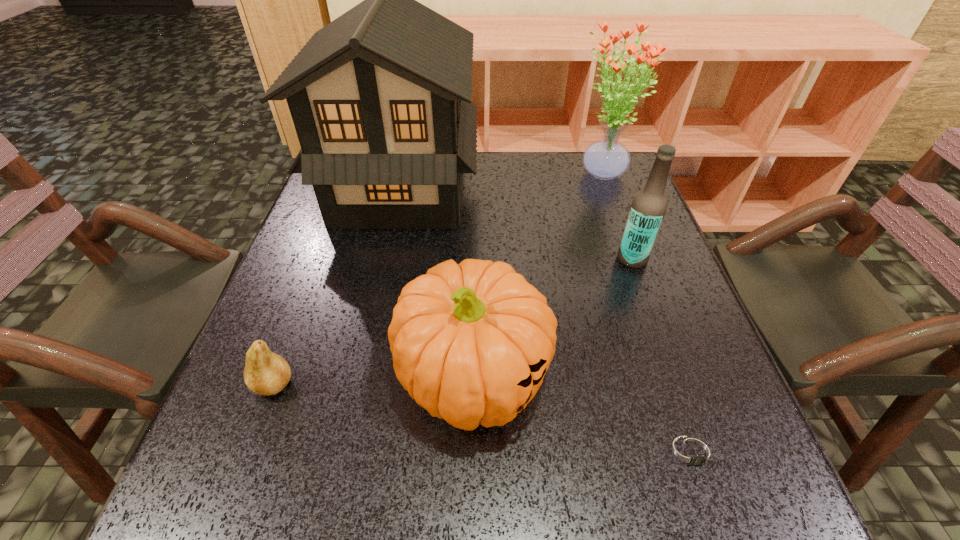
At what (x,y) coordinates should I click in order to perform the action: click on watch that is at the right edge. Please return your answer as a coordinate pair (x, y). This screenshot has width=960, height=540. Looking at the image, I should click on (691, 452).

The image size is (960, 540). Identify the location of object positioned at the far left corner. (380, 98).

Locate an element on the screen. Image resolution: width=960 pixels, height=540 pixels. object that is positioned at the far right corner is located at coordinates (606, 159).

Image resolution: width=960 pixels, height=540 pixels. I want to click on object that is at the near right corner, so click(x=691, y=452).

The height and width of the screenshot is (540, 960). I want to click on vacant region at the far edge of the desktop, so click(x=487, y=166).

Where is `free space at the left edge of the desktop`? Image resolution: width=960 pixels, height=540 pixels. free space at the left edge of the desktop is located at coordinates (289, 338).

Image resolution: width=960 pixels, height=540 pixels. I want to click on free space at the right edge, so click(745, 437).

Identify the location of free space between the second tallest object and the dollhouse. This screenshot has width=960, height=540. (500, 183).

Image resolution: width=960 pixels, height=540 pixels. What are the coordinates of `vacant area between the pumpkin and the flower arrangement` in the screenshot? It's located at (538, 276).

You are a GUI agent. You are given a task and a screenshot of the screen. Output one action in this format:
    pyautogui.click(x=<x>, y=<y>)
    Task: Click on the vacant space in between the second tallest object and the pumpkin
    The image size is (960, 540).
    Given the screenshot: What is the action you would take?
    pyautogui.click(x=538, y=276)